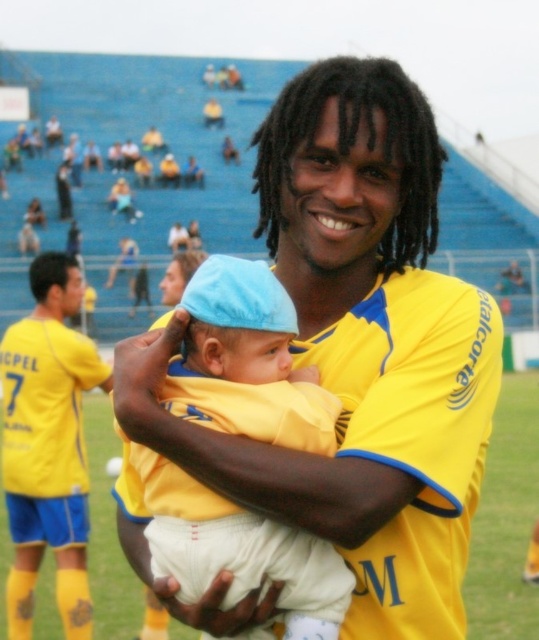
Question: Considering the real-world distances, which object is farthest from the yellow jersey at center?

Choices:
 (A) yellow fabric baby at center
 (B) yellow jersey at left
 (C) light blue fabric hat at center

Answer: (A)

Question: Can you confirm if yellow jersey at center is smaller than yellow jersey at left?

Choices:
 (A) yes
 (B) no

Answer: (A)

Question: Can you confirm if light blue fabric hat at center is positioned to the right of yellow fabric baby at center?

Choices:
 (A) no
 (B) yes

Answer: (B)

Question: Which is farther from the light blue fabric hat at center?

Choices:
 (A) yellow jersey at left
 (B) yellow jersey at center
 (C) yellow fabric baby at center

Answer: (C)

Question: Which point is farther to the camera?

Choices:
 (A) yellow jersey at center
 (B) yellow jersey at left
 (C) light blue fabric hat at center
 (D) yellow fabric baby at center

Answer: (D)

Question: Is yellow jersey at center wider than light blue fabric hat at center?

Choices:
 (A) no
 (B) yes

Answer: (B)